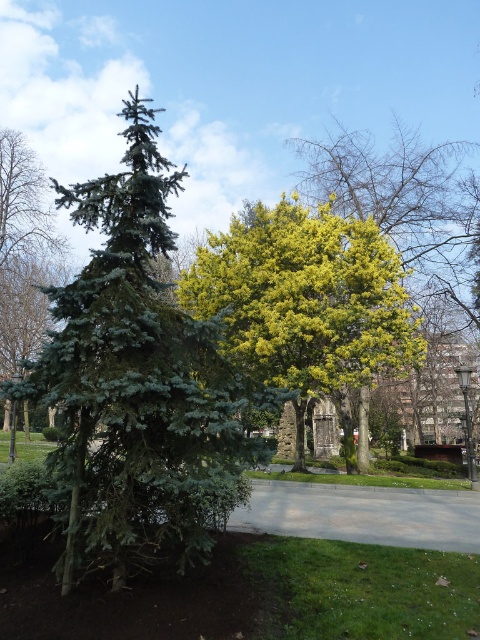
You are a GUI agent. You are given a task and a screenshot of the screen. Output one action in this format:
    pyautogui.click(x=<x>, y=<y>)
    Task: Click on the yellow-green foliage at center
    
    Given the screenshot: What is the action you would take?
    pyautogui.click(x=305, y=300)

Is point (203, 273) behind point (31, 195)?

No, it is not.

Does point (339, 321) lie behind point (4, 355)?

No, (339, 321) is closer to viewer.

Where is `yellow-green foliage at center`? The width and height of the screenshot is (480, 640). yellow-green foliage at center is located at coordinates (305, 300).

Is yellow-green foliage at center thinner than yellow-green leafy tree at upper center?

No.

Is yellow-green foliage at center smaller than yellow-green leafy tree at upper center?

No, yellow-green foliage at center is not smaller than yellow-green leafy tree at upper center.

What are the coordinates of `yellow-green foliage at center` in the screenshot? It's located at (305, 300).

Identify the location of yellow-green leafy tree at upper center. pyautogui.click(x=386, y=186).

Does yellow-green leafy tree at upper center have a lesser width compared to green needle-like tree at left?

Correct, yellow-green leafy tree at upper center's width is less than green needle-like tree at left's.

Between point (410, 161) and point (26, 184), which one is positioned in front?

Point (410, 161) is more forward.

The width and height of the screenshot is (480, 640). I want to click on yellow-green leafy tree at upper center, so click(386, 186).